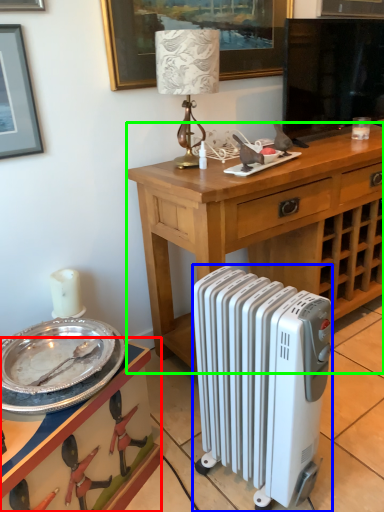
Question: Which object is positioned closest to vanity (highlighted by a red box)? Select from radiator (highlighted by a blue box) and desk (highlighted by a green box).

Choices:
 (A) radiator
 (B) desk

Answer: (A)